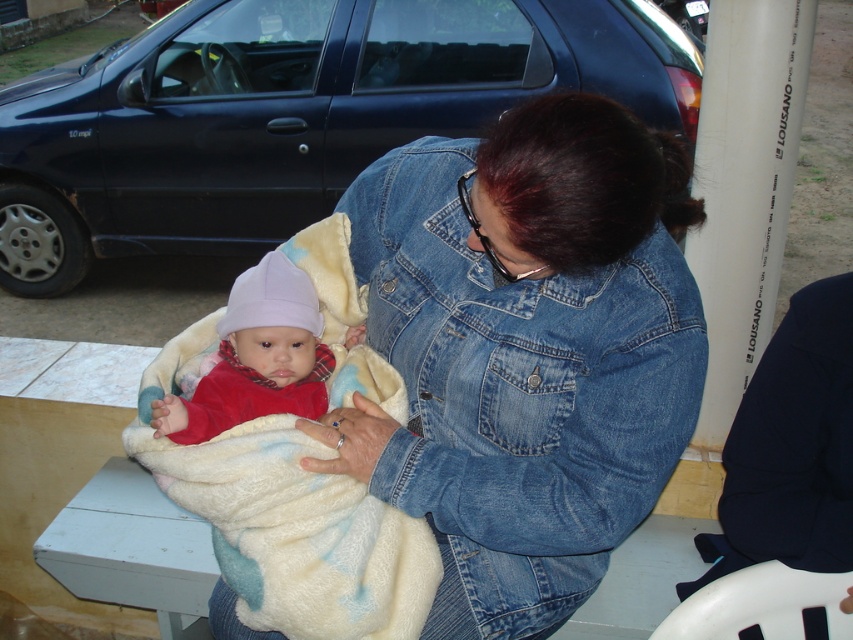
Consider the image. You are a photographer trying to capture a closeup of the baby while ensuring both the denim jacket at center and the matte red sweater at center are visible in the frame. Which item should you focus on first to ensure both are in the shot?

The denim jacket at center is located below the matte red sweater at center. To include both in the frame, focus on the denim jacket at center first since it is lower and adjust the camera angle upwards to capture the matte red sweater at center as well.

Where is the denim jacket at center located in the image?

The denim jacket at center is located at point (520, 390) in the image.